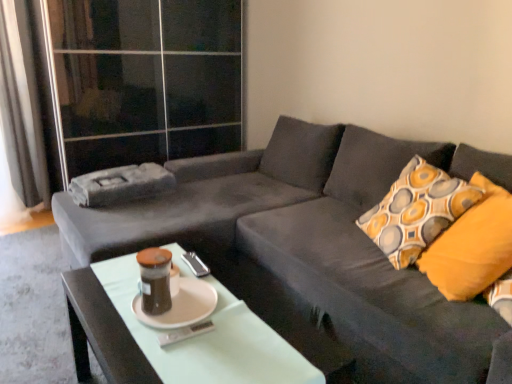
Identify the location of free space to the left of teal glass jar at center. Image resolution: width=512 pixels, height=384 pixels. (106, 302).